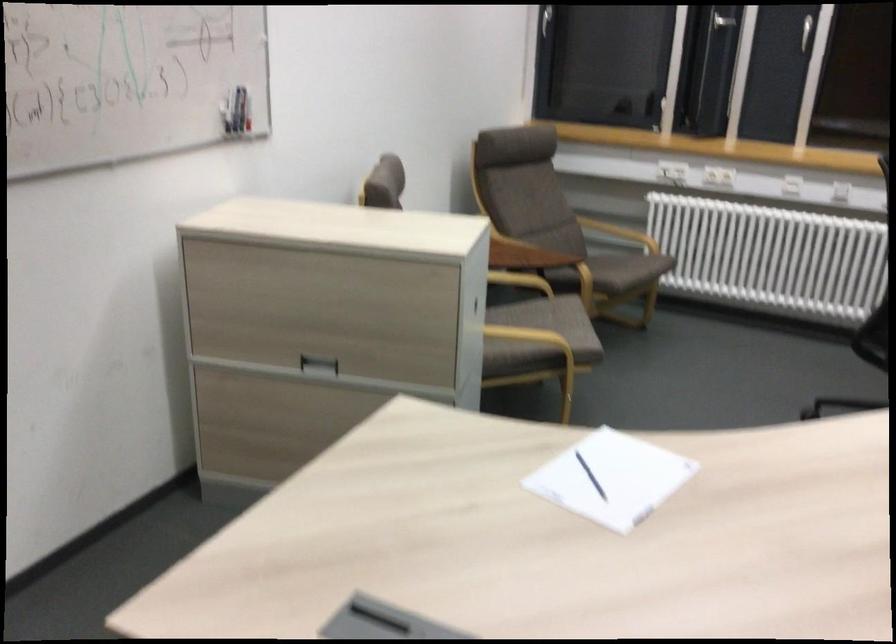
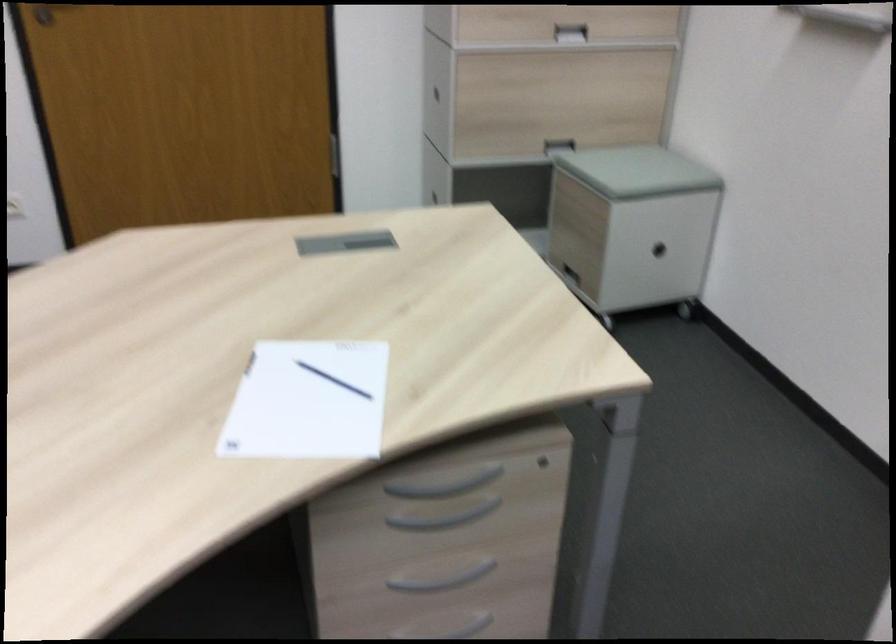
In the second image, find the point that corresponds to point 604,485 in the first image.

(307, 402)